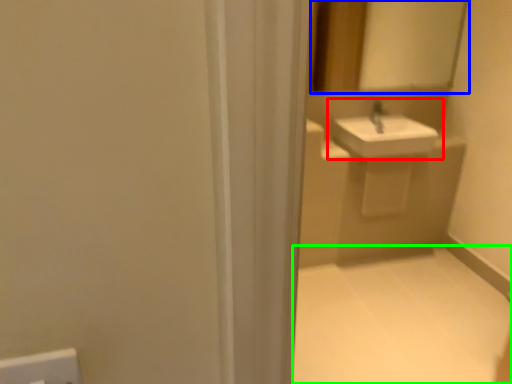
Question: Estimate the real-world distances between objects in this image. Which object is closer to sink (highlighted by a red box), mirror (highlighted by a blue box) or plain (highlighted by a green box)?

Choices:
 (A) mirror
 (B) plain

Answer: (A)